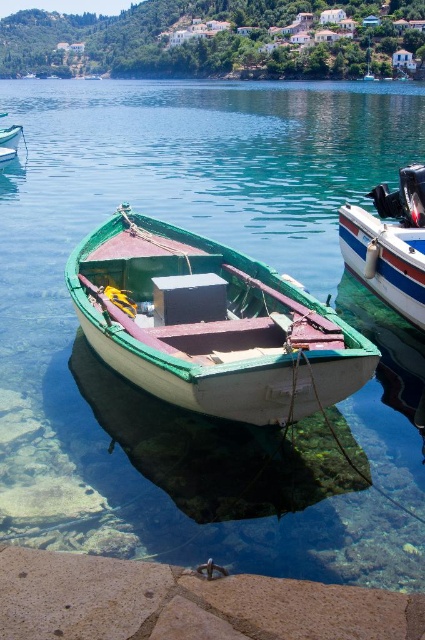
You are a photographer standing on the rocky shoreline and want to take a photo of the brown stone at lower left and the white glossy boat at right. Based on their positions, which object is located to the left of the other?

The brown stone at lower left is positioned on the left side of white glossy boat at right.

You are standing on the rocky shoreline and want to determine which of the two points, point (294, 344) or point (374, 236), is closer to you. Based on the scene, which point is nearer?

Point (294, 344) is closer to the viewer than point (374, 236).

You are a photographer planning to capture the green wooden boat at center and the brown stone at lower left in the same frame. Given that your camera has a fixed focal length, which object should you position closer to the camera to ensure both fit in the frame?

Since the green wooden boat at center is narrower than the brown stone at lower left, you should position the brown stone at lower left closer to the camera. This will make it appear larger in the frame, balancing its size with the boat and ensuring both fit within the composition.